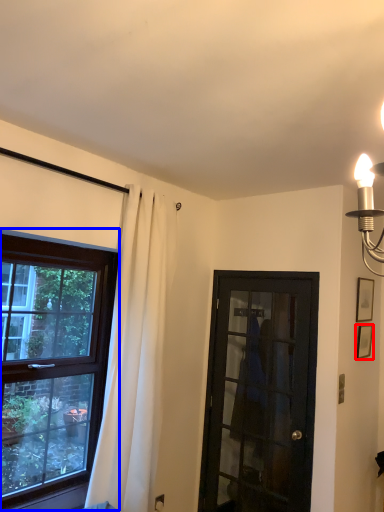
Question: Which object is further to the camera taking this photo, picture frame (highlighted by a red box) or window (highlighted by a blue box)?

Choices:
 (A) picture frame
 (B) window

Answer: (A)